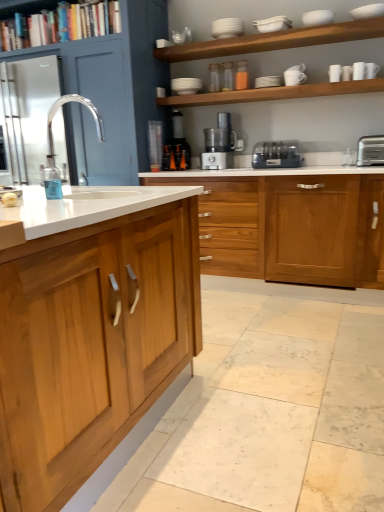
Locate an element on the screen. free point above white marble tile at lower center (from a real-world perspective) is located at coordinates (263, 366).